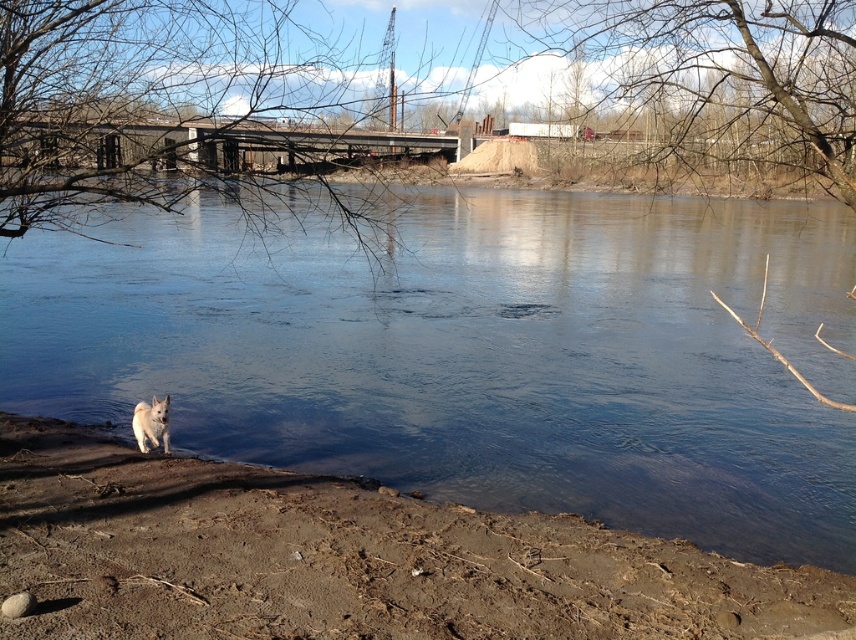
Question: Considering the real-world distances, which object is closest to the clear water at lower left?

Choices:
 (A) white fluffy dog at lower left
 (B) brown dirt at lower left

Answer: (A)

Question: Does clear water at lower left appear on the right side of white fluffy dog at lower left?

Choices:
 (A) yes
 (B) no

Answer: (A)

Question: Which point appears closest to the camera in this image?

Choices:
 (A) (827, 442)
 (B) (168, 433)

Answer: (B)

Question: Which point appears closest to the camera in this image?

Choices:
 (A) (168, 440)
 (B) (498, 557)

Answer: (B)

Question: In this image, where is clear water at lower left located relative to white fluffy dog at lower left?

Choices:
 (A) right
 (B) left

Answer: (A)

Question: Is brown dirt at lower left positioned before white fluffy dog at lower left?

Choices:
 (A) yes
 (B) no

Answer: (A)